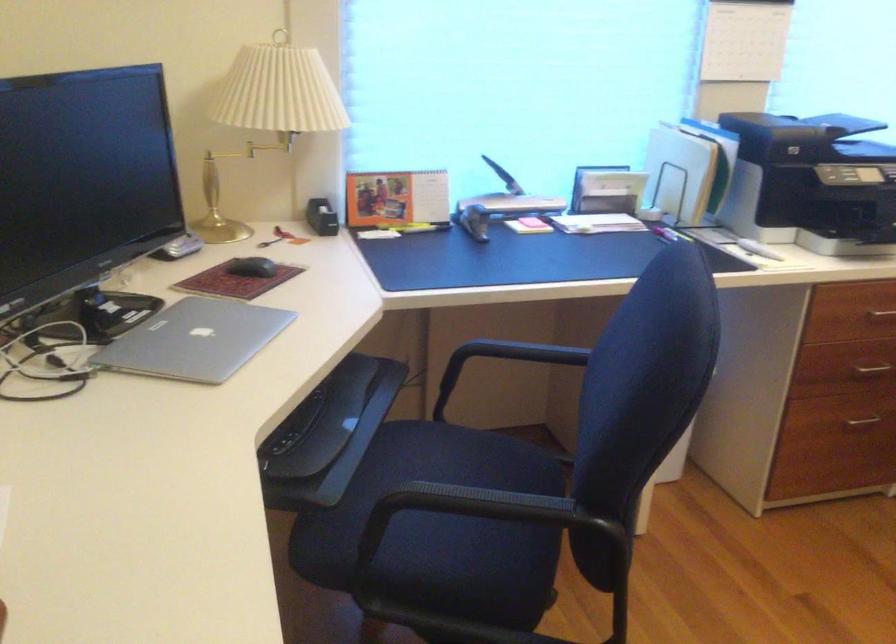
Locate an element on the screen. printer scanner lid is located at coordinates (864, 149).